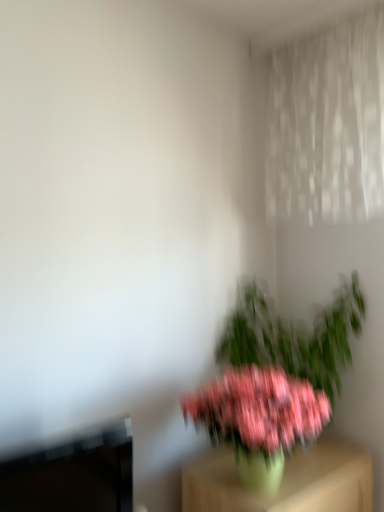
Question: Considering their positions, is pink matte flower at center located in front of or behind pink matte plant at center?

Choices:
 (A) behind
 (B) front

Answer: (B)

Question: Is pink matte flower at center taller or shorter than pink matte plant at center?

Choices:
 (A) short
 (B) tall

Answer: (A)

Question: Which of these objects is positioned farthest from the pink matte plant at center?

Choices:
 (A) pink matte flower at center
 (B) green matte vase at lower right

Answer: (A)

Question: Estimate the real-world distances between objects in this image. Which object is closer to the green matte vase at lower right?

Choices:
 (A) pink matte flower at center
 (B) pink matte plant at center

Answer: (A)